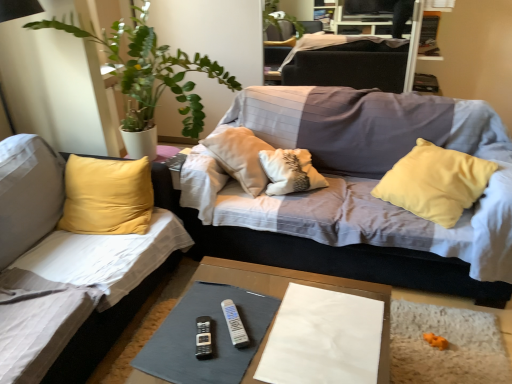
The width and height of the screenshot is (512, 384). I want to click on vacant region to the left of black plastic remote at center, which is the second remote from right to left, so click(x=170, y=342).